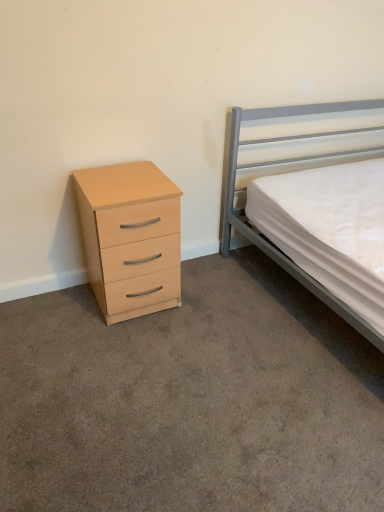
What do you see at coordinates (130, 238) in the screenshot?
I see `matte wood chest of drawers at left` at bounding box center [130, 238].

Where is `matte wood chest of drawers at left`? The width and height of the screenshot is (384, 512). matte wood chest of drawers at left is located at coordinates (130, 238).

The width and height of the screenshot is (384, 512). In order to click on metallic gray bed at right in this screenshot , I will do `click(280, 163)`.

Image resolution: width=384 pixels, height=512 pixels. What do you see at coordinates (280, 163) in the screenshot? I see `metallic gray bed at right` at bounding box center [280, 163].

You are a GUI agent. You are given a task and a screenshot of the screen. Output one action in this format:
    pyautogui.click(x=<x>, y=<y>)
    Task: Click on the matte wood chest of drawers at left
    
    Given the screenshot: What is the action you would take?
    pyautogui.click(x=130, y=238)

In the image, is matte wood chest of drawers at left on the left side or the right side of metallic gray bed at right?

matte wood chest of drawers at left is to the left of metallic gray bed at right.

Which object is further away from the camera taking this photo, matte wood chest of drawers at left or metallic gray bed at right?

matte wood chest of drawers at left is more distant.

Considering the points (128, 231) and (364, 334), which point is behind, point (128, 231) or point (364, 334)?

Positioned behind is point (128, 231).

In the scene shown: From the image's perspective, is matte wood chest of drawers at left above or below metallic gray bed at right?

Based on their image positions, matte wood chest of drawers at left is located beneath metallic gray bed at right.

From a real-world perspective, relative to metallic gray bed at right, is matte wood chest of drawers at left vertically above or below?

In terms of real-world spatial position, matte wood chest of drawers at left is below metallic gray bed at right.

Does matte wood chest of drawers at left have a lesser width compared to metallic gray bed at right?

Correct, the width of matte wood chest of drawers at left is less than that of metallic gray bed at right.

Does matte wood chest of drawers at left have a lesser height compared to metallic gray bed at right?

Yes.

Considering the sizes of objects matte wood chest of drawers at left and metallic gray bed at right in the image provided, who is smaller, matte wood chest of drawers at left or metallic gray bed at right?

matte wood chest of drawers at left is smaller.

Is matte wood chest of drawers at left outside of metallic gray bed at right?

Yes.

Is matte wood chest of drawers at left with metallic gray bed at right?

There is a gap between matte wood chest of drawers at left and metallic gray bed at right.

Is matte wood chest of drawers at left facing away from metallic gray bed at right?

matte wood chest of drawers at left does not have its back to metallic gray bed at right.

Measure the distance from matte wood chest of drawers at left to metallic gray bed at right.

They are 29.22 inches apart.

The height and width of the screenshot is (512, 384). I want to click on bed above the matte wood chest of drawers at left (from a real-world perspective), so click(280, 163).

Is metallic gray bed at right to the left or to the right of matte wood chest of drawers at left in the image?

Based on their positions, metallic gray bed at right is located to the right of matte wood chest of drawers at left.

Relative to matte wood chest of drawers at left, is metallic gray bed at right in front or behind?

In the image, metallic gray bed at right appears in front of matte wood chest of drawers at left.

Which is in front, point (319, 155) or point (85, 198)?

The point (85, 198) is more forward.

From the image's perspective, is metallic gray bed at right below matte wood chest of drawers at left?

Actually, metallic gray bed at right appears above matte wood chest of drawers at left in the image.

From a real-world perspective, is metallic gray bed at right positioned under matte wood chest of drawers at left based on gravity?

No, from a real-world perspective, metallic gray bed at right is not below matte wood chest of drawers at left.

Can you confirm if metallic gray bed at right is wider than matte wood chest of drawers at left?

Yes.

Looking at this image, considering the sizes of objects metallic gray bed at right and matte wood chest of drawers at left in the image provided, who is shorter, metallic gray bed at right or matte wood chest of drawers at left?

matte wood chest of drawers at left.

Is metallic gray bed at right bigger or smaller than matte wood chest of drawers at left?

In the image, metallic gray bed at right appears to be larger than matte wood chest of drawers at left.

Is metallic gray bed at right inside or outside of matte wood chest of drawers at left?

metallic gray bed at right is outside matte wood chest of drawers at left.

Are metallic gray bed at right and matte wood chest of drawers at left located far from each other?

No, metallic gray bed at right is in close proximity to matte wood chest of drawers at left.

In the scene shown: Is matte wood chest of drawers at left at the back of metallic gray bed at right?

No, matte wood chest of drawers at left is not at the back of metallic gray bed at right.

Consider the image. How many degrees apart are the facing directions of metallic gray bed at right and matte wood chest of drawers at left?

1.87 degrees.

Measure the distance between metallic gray bed at right and matte wood chest of drawers at left.

metallic gray bed at right and matte wood chest of drawers at left are 29.22 inches apart.

This screenshot has height=512, width=384. I want to click on chest of drawers below the metallic gray bed at right (from the image's perspective), so click(130, 238).

You are a GUI agent. You are given a task and a screenshot of the screen. Output one action in this format:
    pyautogui.click(x=<x>, y=<y>)
    Task: Click on the chest of drawers behind the metallic gray bed at right
    This screenshot has height=512, width=384.
    Given the screenshot: What is the action you would take?
    pyautogui.click(x=130, y=238)

Where is `bed positioned vertically above the matte wood chest of drawers at left (from a real-world perspective)`? The height and width of the screenshot is (512, 384). bed positioned vertically above the matte wood chest of drawers at left (from a real-world perspective) is located at coordinates (280, 163).